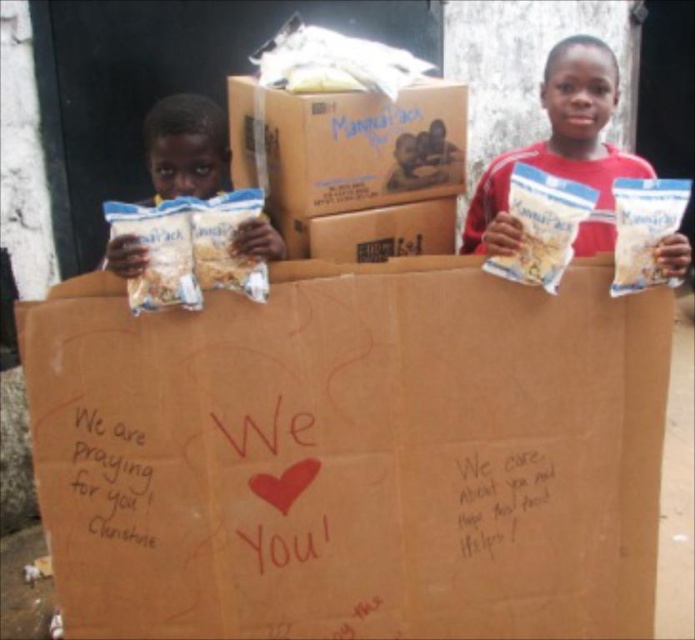
Question: Is brown cardboard at center bigger than white matte bag at center?

Choices:
 (A) yes
 (B) no

Answer: (A)

Question: Which point is closer to the camera?

Choices:
 (A) (496, 369)
 (B) (306, 170)
 (C) (673, 260)
 (D) (147, 131)

Answer: (C)

Question: Is brown cardboard box at center positioned at the back of white matte bag at left?

Choices:
 (A) yes
 (B) no

Answer: (B)

Question: Which object is farther from the camera taking this photo?

Choices:
 (A) brown cardboard box at center
 (B) white matte bag at left

Answer: (B)

Question: Is brown cardboard at center further to the viewer compared to white matte bag at center?

Choices:
 (A) no
 (B) yes

Answer: (A)

Question: Among these points, which one is nearest to the camera?

Choices:
 (A) (136, 272)
 (B) (662, 253)
 (C) (427, 560)

Answer: (A)